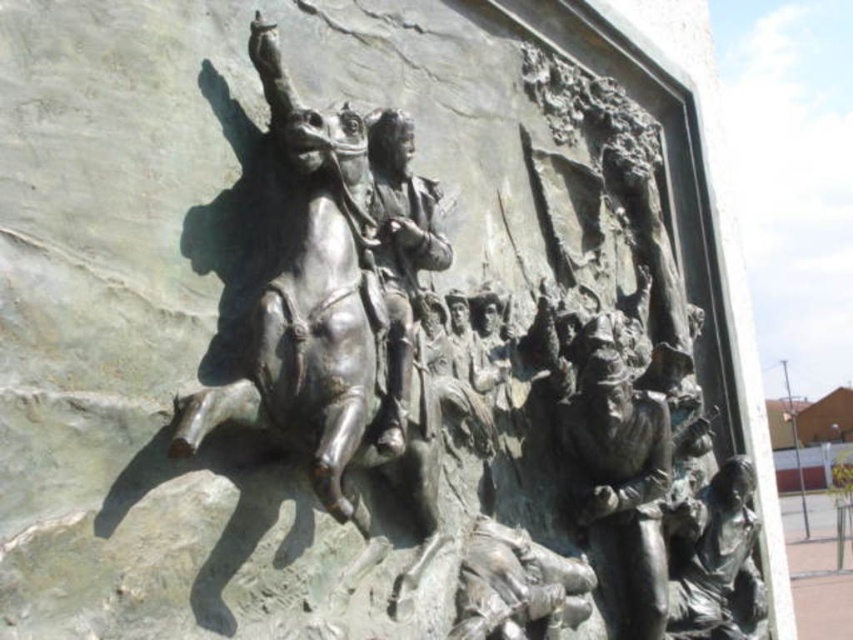
Question: Estimate the real-world distances between objects in this image. Which object is closer to the bronze horseman at center?

Choices:
 (A) bronze figure at center
 (B) bronze statue at lower right

Answer: (A)

Question: Does bronze sculpture at center have a smaller size compared to bronze statue figure at center?

Choices:
 (A) no
 (B) yes

Answer: (A)

Question: Which point is farther to the camera?

Choices:
 (A) (277, 394)
 (B) (686, 515)
 (C) (607, 412)

Answer: (B)

Question: Where is bronze sculpture at center located in relation to bronze figure at center in the image?

Choices:
 (A) below
 (B) above

Answer: (B)

Question: Can you confirm if bronze statue figure at center is positioned to the left of bronze figure at center?

Choices:
 (A) no
 (B) yes

Answer: (A)

Question: Which is nearer to the bronze sculpture at center?

Choices:
 (A) bronze statue at lower right
 (B) bronze statue figure at center

Answer: (B)